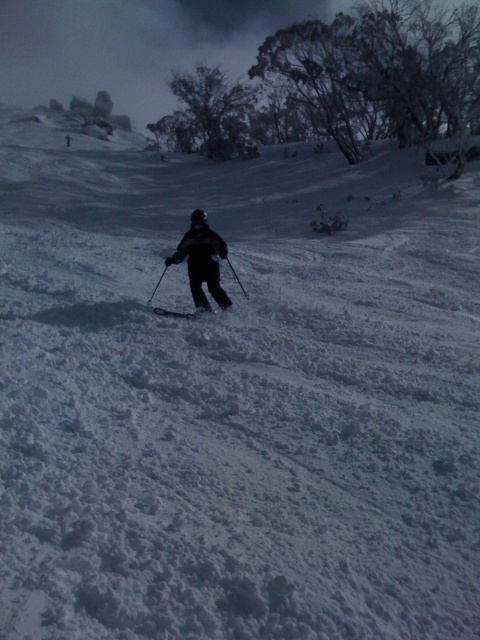
Question: Which point is closer to the camera taking this photo?

Choices:
 (A) (168, 314)
 (B) (207, 262)

Answer: (A)

Question: In this image, where is dark gray ski suit at center located relative to matte black ski at center?

Choices:
 (A) left
 (B) right

Answer: (A)

Question: Can you confirm if dark gray ski suit at center is wider than matte black ski at center?

Choices:
 (A) no
 (B) yes

Answer: (B)

Question: Among these points, which one is nearest to the camera?

Choices:
 (A) (204, 276)
 (B) (165, 316)

Answer: (B)

Question: Can you confirm if dark gray ski suit at center is positioned to the left of matte black ski at center?

Choices:
 (A) no
 (B) yes

Answer: (B)